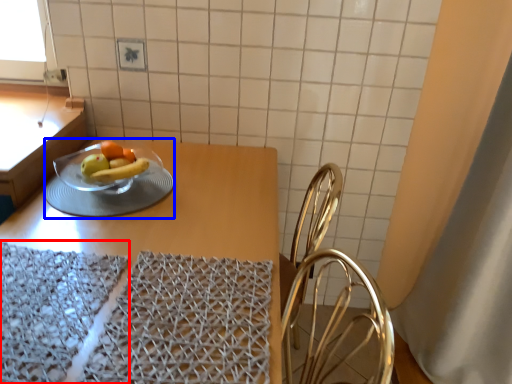
Question: Which point is further to the camera, place mat (highlighted by a red box) or tableware (highlighted by a blue box)?

Choices:
 (A) place mat
 (B) tableware

Answer: (B)